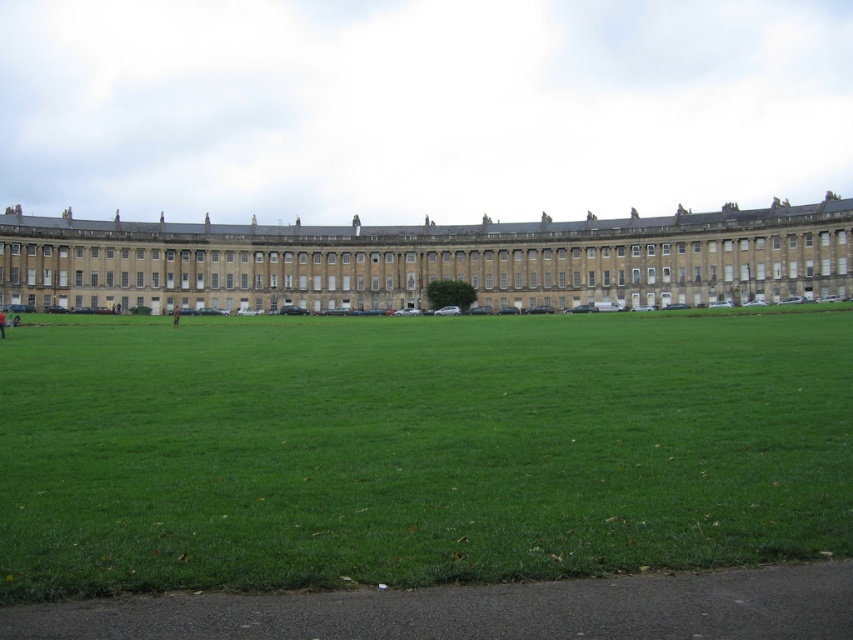
Question: Does green grass at center appear under beige stone palace at center?

Choices:
 (A) no
 (B) yes

Answer: (B)

Question: Does green grass at center appear over beige stone palace at center?

Choices:
 (A) yes
 (B) no

Answer: (B)

Question: Which object appears closest to the camera in this image?

Choices:
 (A) beige stone palace at center
 (B) green grass at center

Answer: (B)

Question: Which object is farther from the camera taking this photo?

Choices:
 (A) green grass at center
 (B) beige stone palace at center

Answer: (B)

Question: Is green grass at center positioned before beige stone palace at center?

Choices:
 (A) no
 (B) yes

Answer: (B)